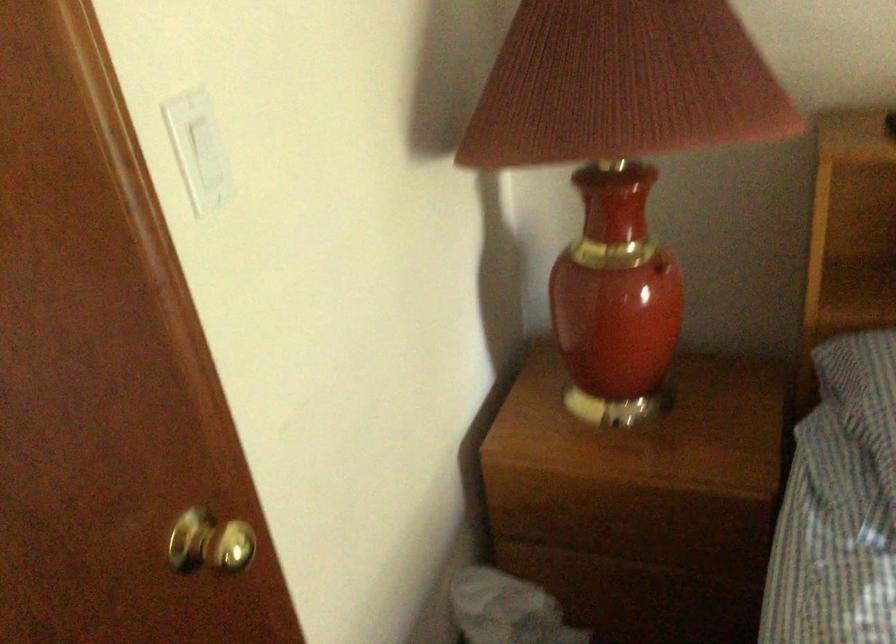
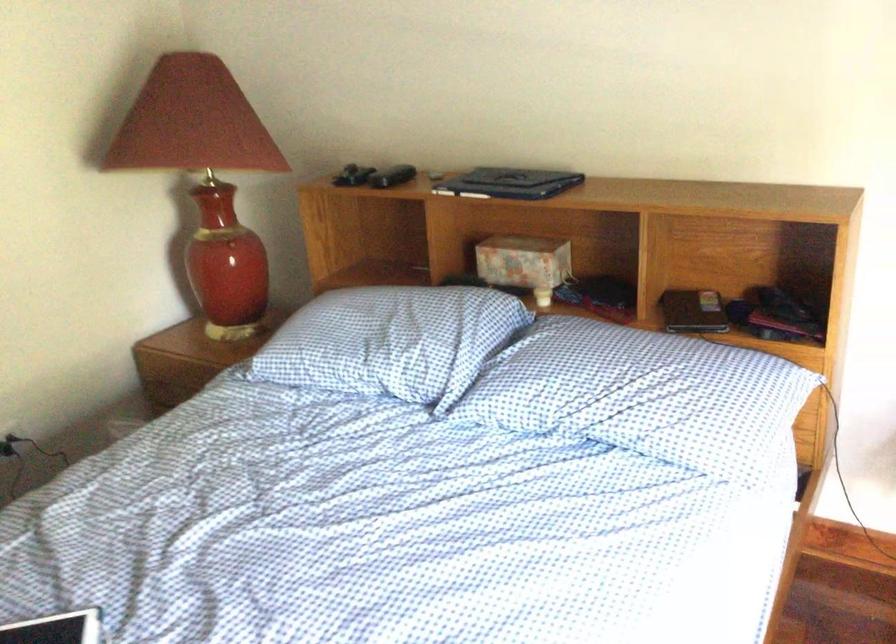
In the second image, find the point that corresponds to the point at 682,296 in the first image.

(229, 249)